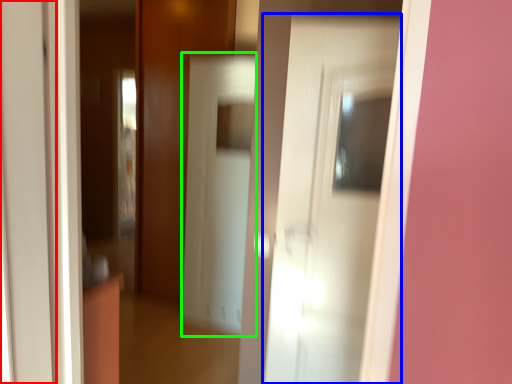
Question: Which object is the closest to the door (highlighted by a red box)? Choose among these: door (highlighted by a blue box) or screen door (highlighted by a green box).

Choices:
 (A) door
 (B) screen door

Answer: (A)